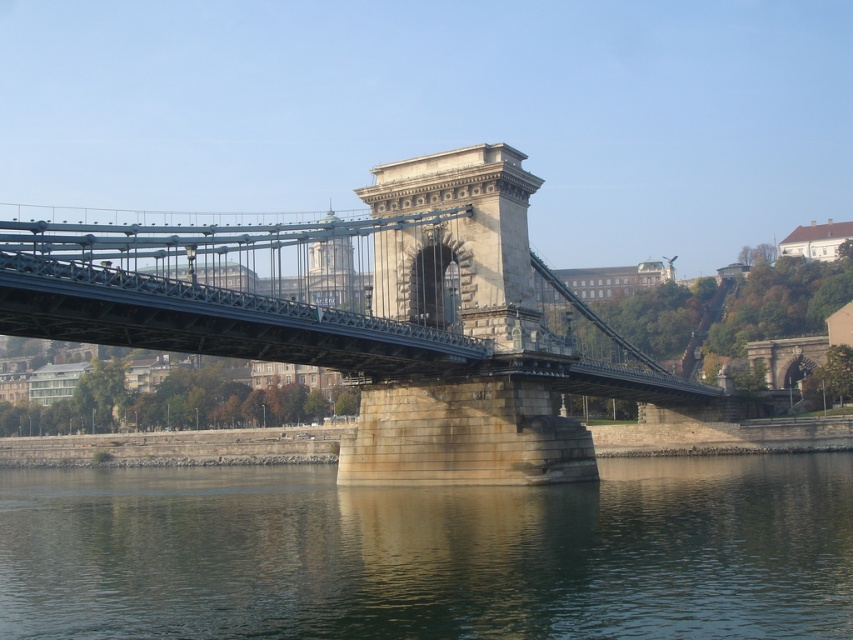
Which is above, greenish water at lower center or metallic stone bridge at center?

metallic stone bridge at center is above.

Between greenish water at lower center and metallic stone bridge at center, which one is positioned lower?

greenish water at lower center

Where is `greenish water at lower center`? Image resolution: width=853 pixels, height=640 pixels. greenish water at lower center is located at coordinates (430, 552).